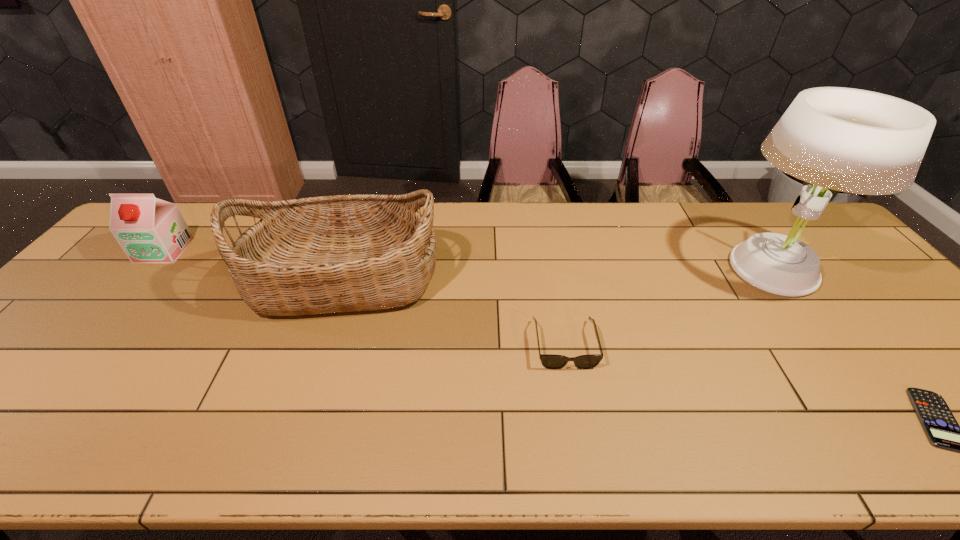
Locate an element on the screen. free space located at the front lenses of the third object from right to left is located at coordinates pos(581,434).

Locate an element on the screen. The height and width of the screenshot is (540, 960). lamp at the far edge is located at coordinates coord(851,140).

Find the location of a particular element. basket that is positioned at the far edge is located at coordinates (344, 253).

The height and width of the screenshot is (540, 960). Find the location of `soya milk present at the far edge`. soya milk present at the far edge is located at coordinates (149, 230).

At what (x,y) coordinates should I click in order to perform the action: click on object situated at the left edge. Please return your answer as a coordinate pair (x, y). The width and height of the screenshot is (960, 540). Looking at the image, I should click on (149, 230).

Locate an element on the screen. This screenshot has width=960, height=540. object that is at the right edge is located at coordinates (851, 140).

You are a GUI agent. You are given a task and a screenshot of the screen. Output one action in this format:
    pyautogui.click(x=<x>, y=<y>)
    Task: Click on the object located at the far left corner
    This screenshot has width=960, height=540.
    Given the screenshot: What is the action you would take?
    pyautogui.click(x=149, y=230)

The image size is (960, 540). In order to click on object positioned at the far right corner in this screenshot , I will do `click(851, 140)`.

In the image, there is a desktop. At what (x,y) coordinates should I click in order to perform the action: click on vacant space at the far edge. Please return your answer as a coordinate pair (x, y). This screenshot has height=540, width=960. Looking at the image, I should click on (474, 228).

At what (x,y) coordinates should I click in order to perform the action: click on free space at the near edge of the desktop. Please return your answer as a coordinate pair (x, y). Image resolution: width=960 pixels, height=540 pixels. Looking at the image, I should click on (372, 433).